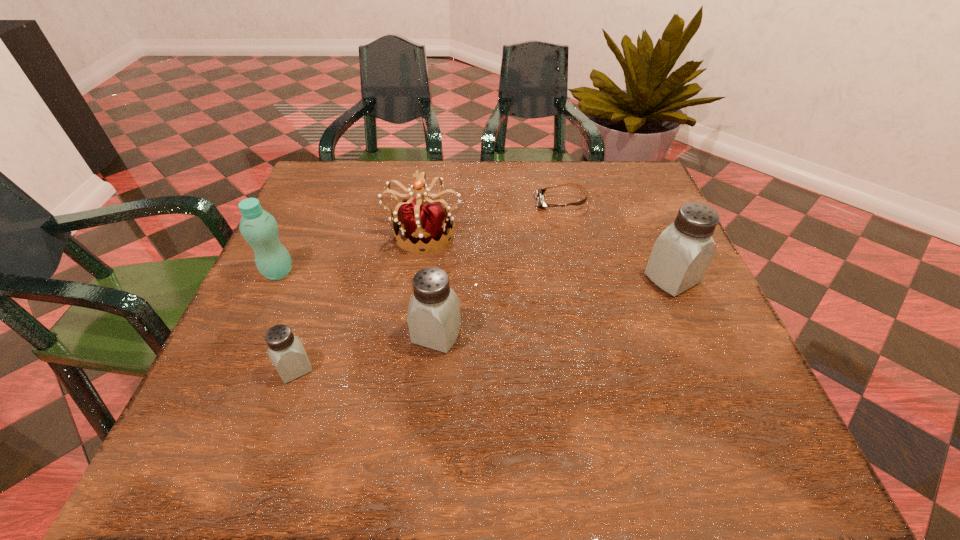
Locate which object ranks second in proximity to the shortest object. Please provide its 2D coordinates. Your answer should be formatted as a tuple, i.e. [(x, y)], where the tuple contains the x and y coordinates of a point satisfying the conditions above.

[(682, 254)]

Locate which object is the fourth closest to the farthest saltshaker. Please provide its 2D coordinates. Your answer should be formatted as a tuple, i.e. [(x, y)], where the tuple contains the x and y coordinates of a point satisfying the conditions above.

[(285, 350)]

Locate an element on the screen. Image resolution: width=960 pixels, height=540 pixels. saltshaker object that ranks as the second closest to the rightmost object is located at coordinates (285, 350).

Where is `the third closest saltshaker to the bottle`? the third closest saltshaker to the bottle is located at coordinates (682, 254).

Where is `free space that satisfies the following two spatial constraints: 1. on the back side of the farthest saltshaker; 2. on the left side of the second saltshaker from right to left`? The image size is (960, 540). free space that satisfies the following two spatial constraints: 1. on the back side of the farthest saltshaker; 2. on the left side of the second saltshaker from right to left is located at coordinates (442, 279).

Locate an element on the screen. free space that satisfies the following two spatial constraints: 1. on the front-facing side of the second object from right to left; 2. on the front-facing side of the tiara is located at coordinates (567, 232).

Locate an element on the screen. The image size is (960, 540). free location that satisfies the following two spatial constraints: 1. on the front-facing side of the shortest object; 2. on the front side of the second tallest saltshaker is located at coordinates (590, 335).

What are the coordinates of `free point that satisfies the following two spatial constraints: 1. on the front-facing side of the goggles; 2. on the front side of the second shortest saltshaker` in the screenshot? It's located at 590,335.